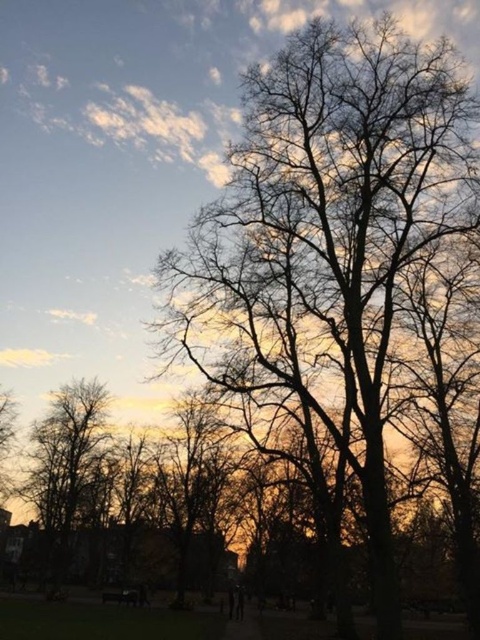
You are a photographer setting up a shot of the scene. You have two points marked in the image at coordinates point (36, 452) and point (133, 602). Which point is closer to your camera lens?

Point (36, 452) is further to the camera than point (133, 602), so the point closer to the camera lens is point (36, 452).